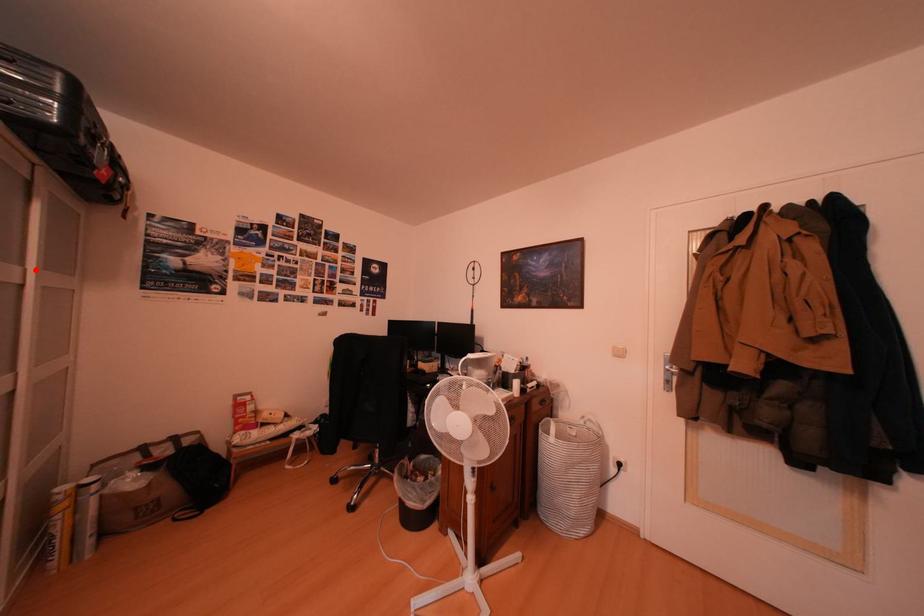
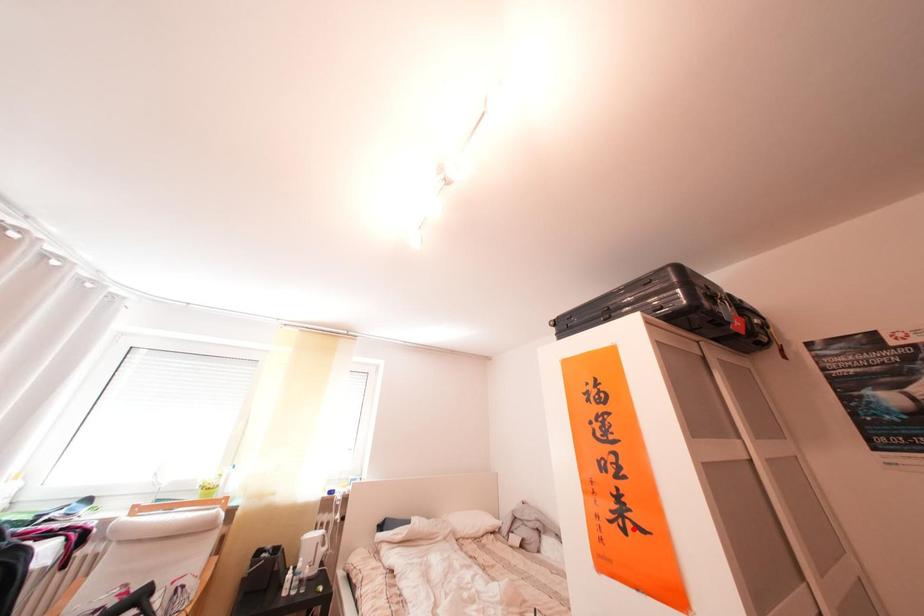
I am providing you with two images of the same scene from different viewpoints. A red point is marked on the first image and another point is marked on the second image. Does the point marked in image1 correspond to the same location as the one in image2?

No